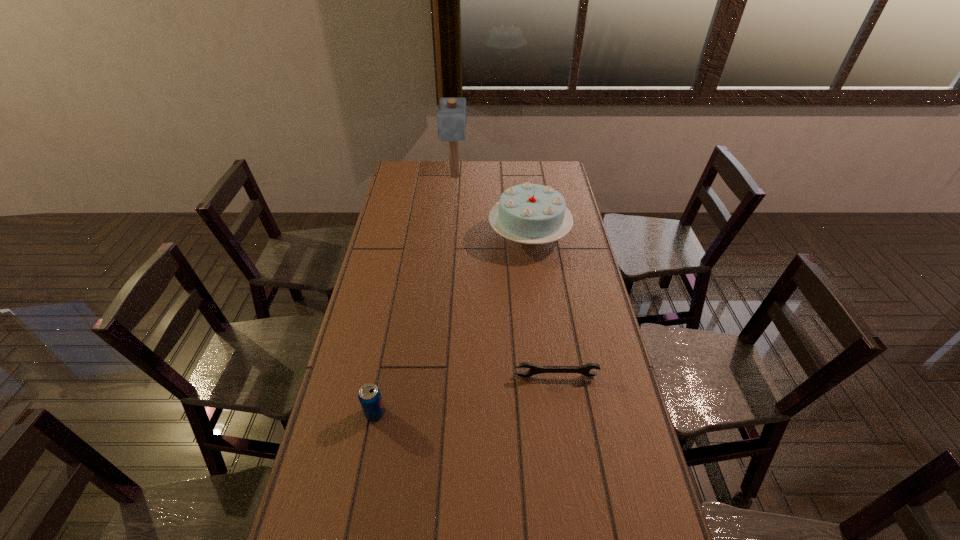
Identify the location of the third object from left to right. This screenshot has height=540, width=960. (451, 118).

The width and height of the screenshot is (960, 540). I want to click on the farthest object, so click(451, 118).

Locate an element on the screen. Image resolution: width=960 pixels, height=540 pixels. birthday cake is located at coordinates (528, 213).

Locate an element on the screen. The height and width of the screenshot is (540, 960). the second farthest object is located at coordinates (528, 213).

At what (x,y) coordinates should I click in order to perform the action: click on the third shortest object. Please return your answer as a coordinate pair (x, y). This screenshot has height=540, width=960. Looking at the image, I should click on (369, 395).

This screenshot has height=540, width=960. I want to click on the fourth farthest object, so click(369, 395).

I want to click on the farther wrench, so click(585, 369).

Image resolution: width=960 pixels, height=540 pixels. I want to click on the third nearest object, so click(585, 369).

Find the location of `free spot located on the left of the farthest object`. free spot located on the left of the farthest object is located at coordinates (422, 177).

Where is `free space located on the front of the second farthest object`? The width and height of the screenshot is (960, 540). free space located on the front of the second farthest object is located at coordinates (536, 282).